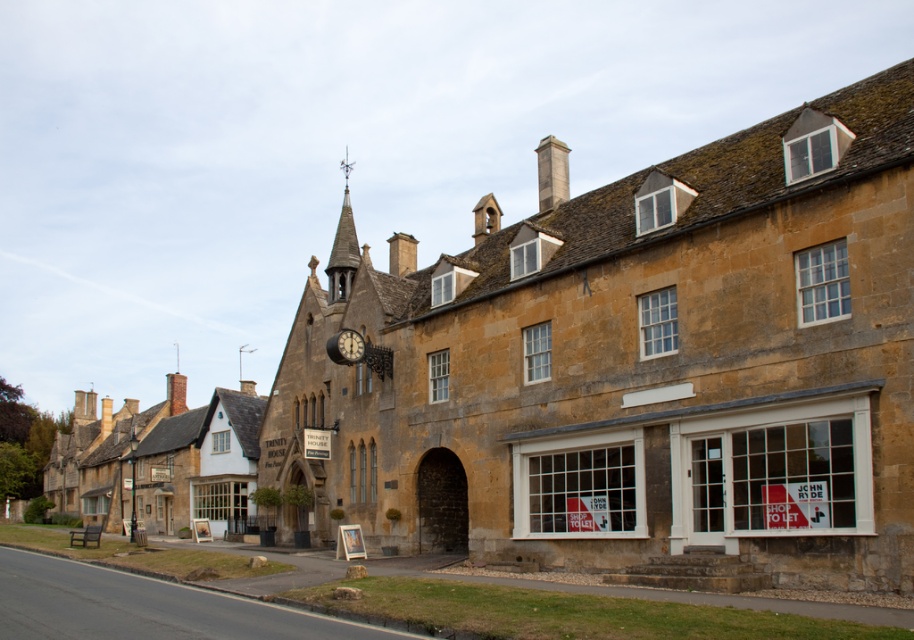
Question: Among these points, which one is nearest to the camera?

Choices:
 (A) (357, 337)
 (B) (335, 292)

Answer: (A)

Question: Can you confirm if smooth stone spire at upper center is wider than metallic clock at center?

Choices:
 (A) no
 (B) yes

Answer: (B)

Question: Is smooth stone spire at upper center smaller than metallic clock at center?

Choices:
 (A) yes
 (B) no

Answer: (B)

Question: Does smooth stone spire at upper center have a lesser width compared to metallic clock at center?

Choices:
 (A) yes
 (B) no

Answer: (B)